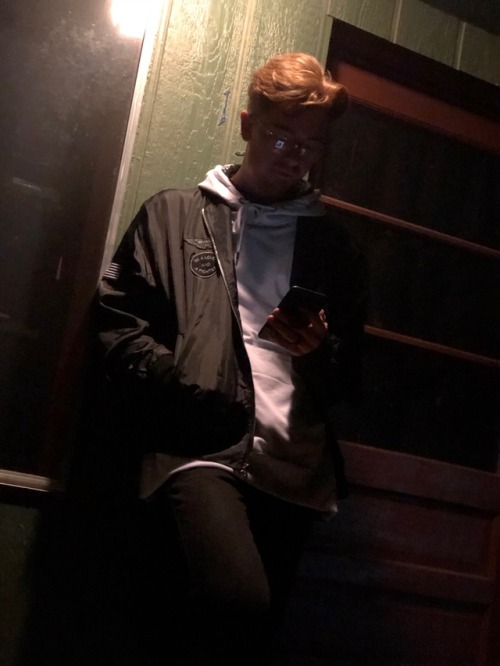
Find the location of a particular element. window is located at coordinates (440, 270).